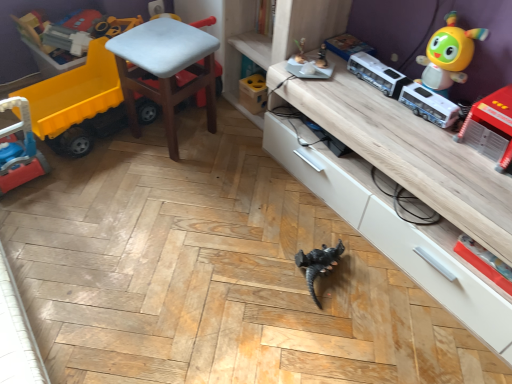
You are a GUI agent. You are given a task and a screenshot of the screen. Output one action in this format:
    pyautogui.click(x=<x>, y=<y>)
    Task: Click on the free space above wooden cabinet at lower center (from a real-world perspective)
    The height and width of the screenshot is (384, 512).
    Given the screenshot: What is the action you would take?
    pyautogui.click(x=408, y=124)